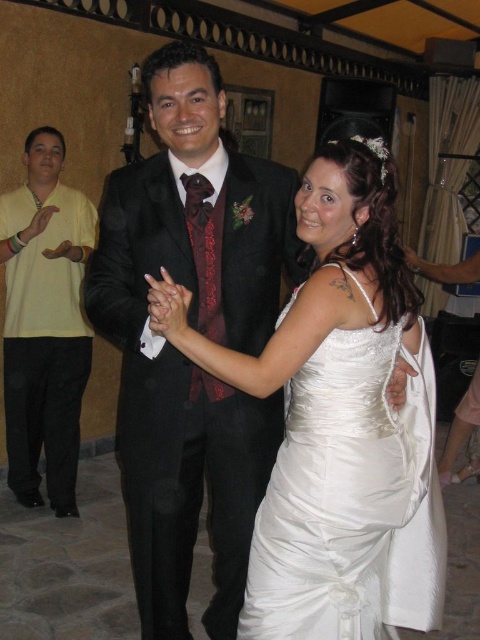
Question: Is satin white dress at center closer to the viewer compared to yellow cotton shirt at left?

Choices:
 (A) no
 (B) yes

Answer: (B)

Question: Among these points, which one is farthest from the camera?

Choices:
 (A) (428, 545)
 (B) (60, 282)
 (C) (163, 116)

Answer: (B)

Question: Which of these objects is positioned closest to the shiny black suit at center?

Choices:
 (A) yellow cotton shirt at left
 (B) satin white dress at center

Answer: (B)

Question: Does shiny black suit at center appear under satin white dress at center?

Choices:
 (A) yes
 (B) no

Answer: (B)

Question: Does shiny black suit at center appear on the left side of yellow cotton shirt at left?

Choices:
 (A) no
 (B) yes

Answer: (A)

Question: Which of the following is the farthest from the observer?

Choices:
 (A) (27, 164)
 (B) (287, 305)

Answer: (A)